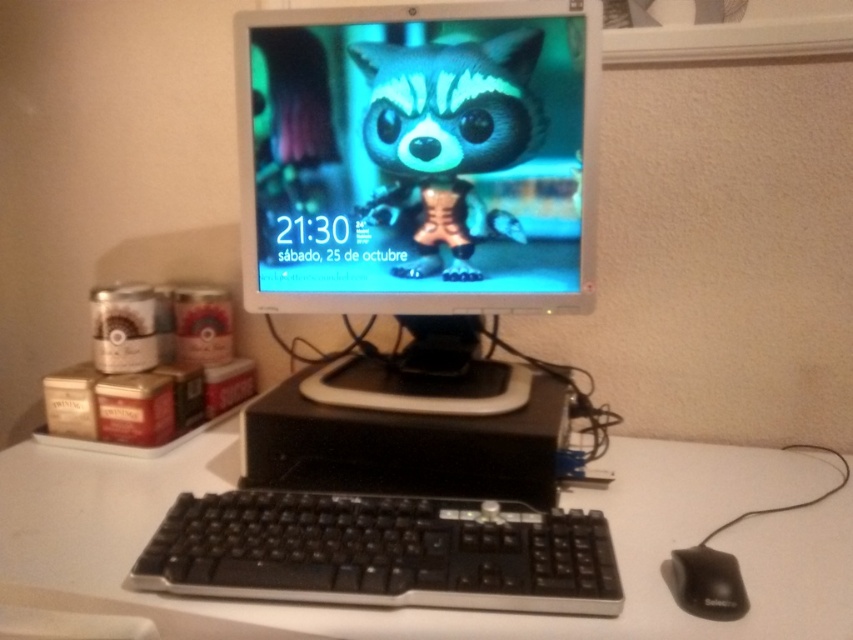
Question: Which point appears closest to the camera in this image?

Choices:
 (A) (741, 531)
 (B) (734, 589)

Answer: (B)

Question: Observing the image, what is the correct spatial positioning of white matte table at center in reference to black matte mouse at lower right?

Choices:
 (A) left
 (B) right

Answer: (A)

Question: Can you confirm if white matte table at center is positioned to the left of black plastic keyboard at center?

Choices:
 (A) no
 (B) yes

Answer: (A)

Question: Among these objects, which one is farthest from the camera?

Choices:
 (A) satin silver monitor at center
 (B) white matte table at center
 (C) black plastic keyboard at center

Answer: (A)

Question: Is satin silver monitor at center in front of black plastic keyboard at center?

Choices:
 (A) yes
 (B) no

Answer: (B)

Question: Which object appears farthest from the camera in this image?

Choices:
 (A) black plastic keyboard at center
 (B) black matte mouse at lower right

Answer: (B)